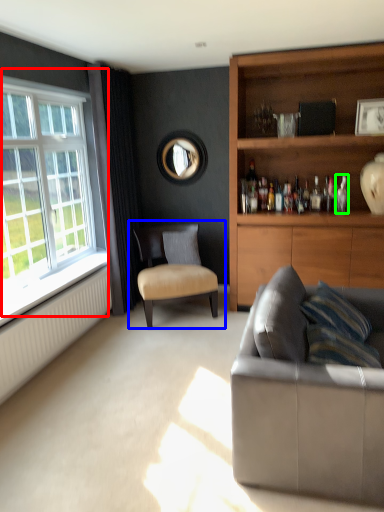
Question: Estimate the real-world distances between objects in this image. Which object is farther from window (highlighted by a red box), chair (highlighted by a blue box) or bottle (highlighted by a green box)?

Choices:
 (A) chair
 (B) bottle

Answer: (B)